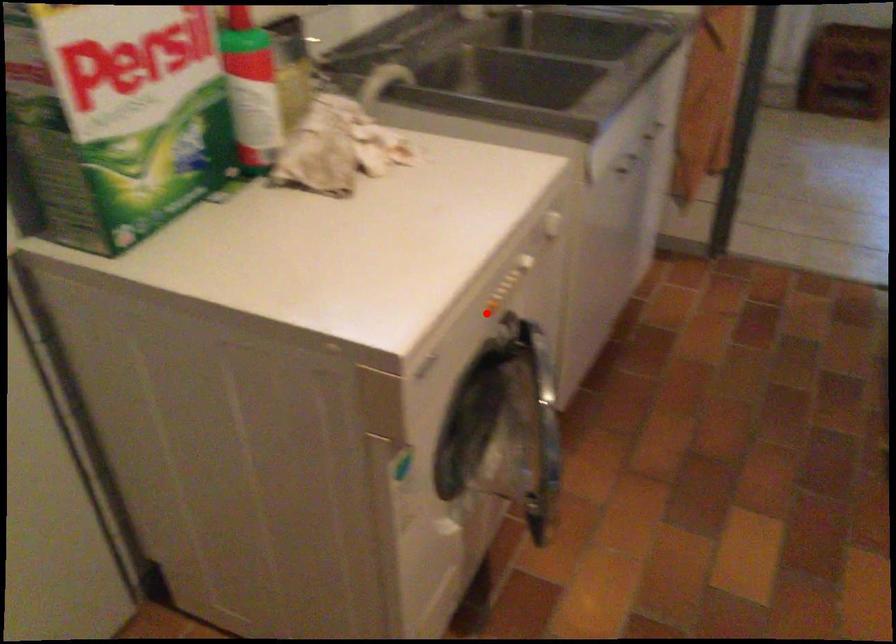
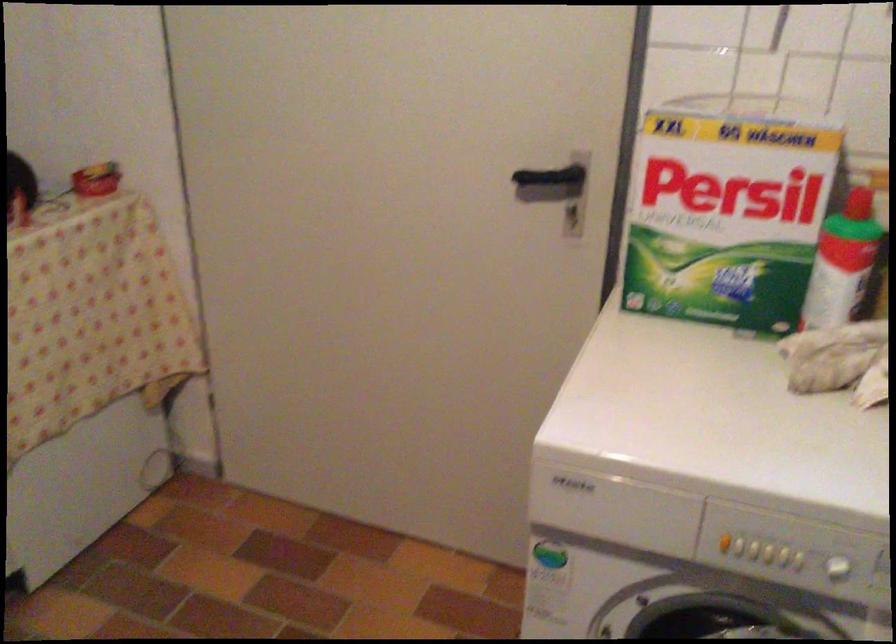
Find the pixel in the second image that matches the highlighted location in the first image.

(724, 542)